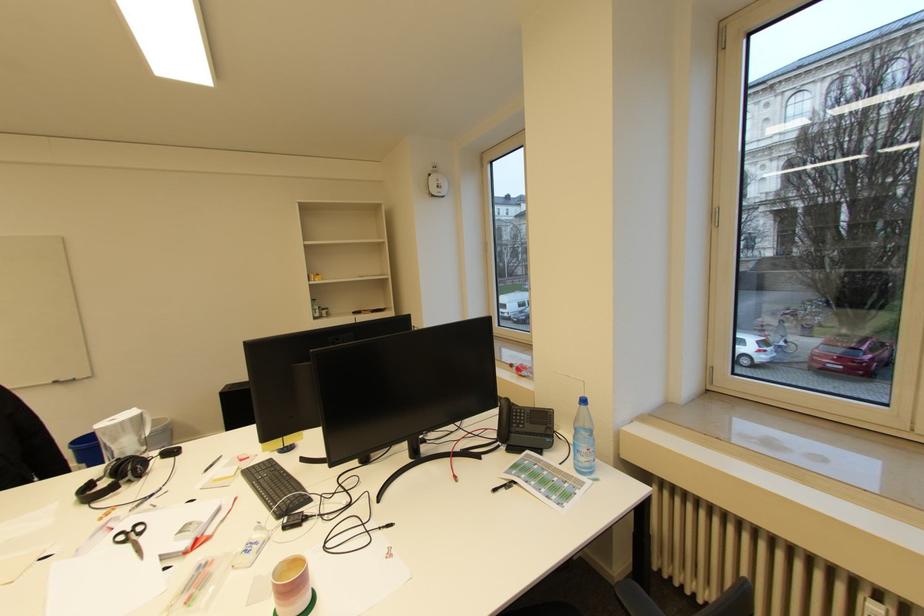
What do you see at coordinates (537, 419) in the screenshot? I see `the telephone button` at bounding box center [537, 419].